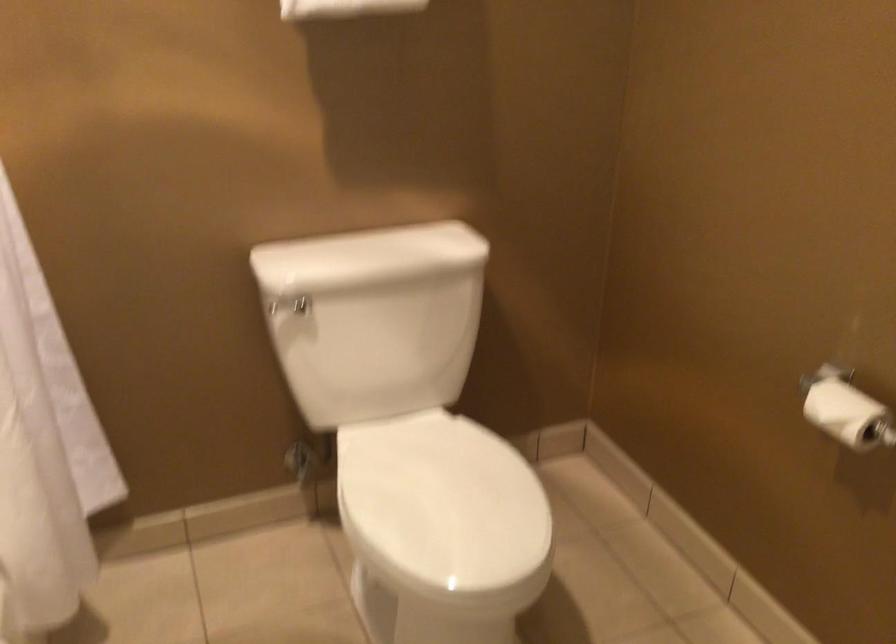
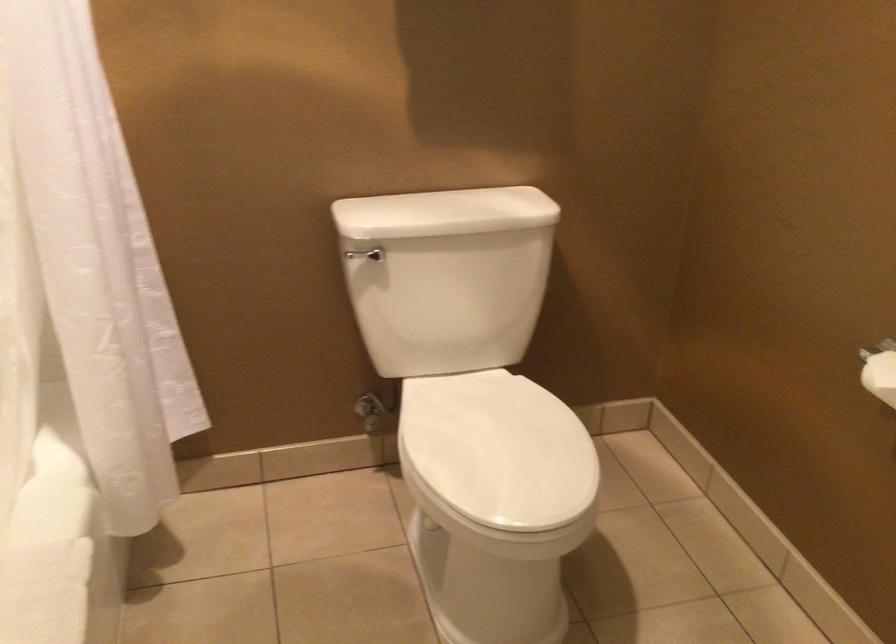
What movement of the cameraman would produce the second image?

The cameraman walked toward right, backward.